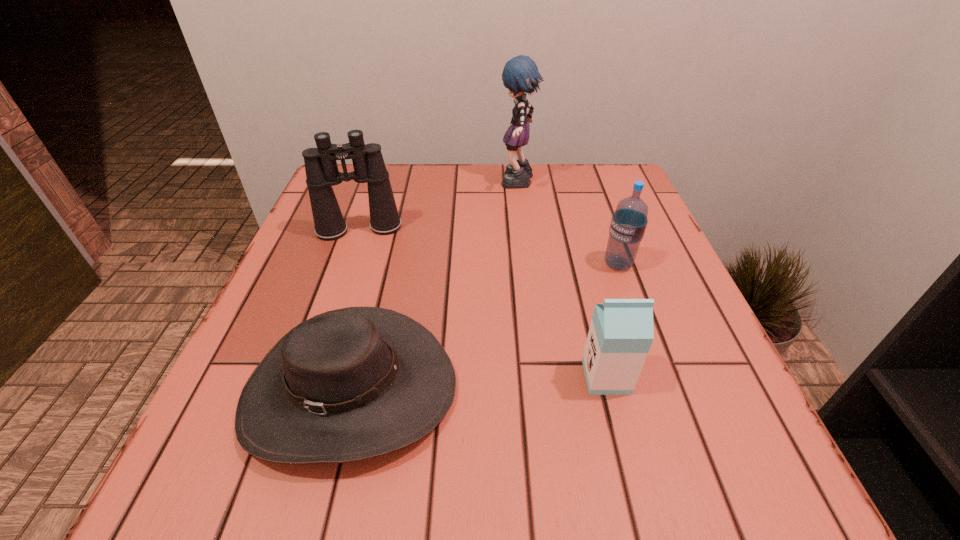
You are a GUI agent. You are given a task and a screenshot of the screen. Output one action in this format:
    pyautogui.click(x=<x>, y=<y>)
    Task: Click on the vacant space located on the front-facing side of the tallest object
    
    Given the screenshot: What is the action you would take?
    pyautogui.click(x=428, y=184)

Locate an element on the screen. This screenshot has width=960, height=540. vacant area located 0.370m on the front of the binoculars is located at coordinates (303, 390).

The width and height of the screenshot is (960, 540). What are the coordinates of `free space located on the front of the rightmost object` in the screenshot? It's located at (666, 400).

In order to click on free region located on the left of the second object from right to left in this screenshot , I will do `click(412, 377)`.

In order to click on object that is at the far edge in this screenshot , I will do `click(520, 75)`.

Where is `object situated at the near edge`? object situated at the near edge is located at coordinates (350, 384).

Find the location of a particular element. This screenshot has width=960, height=540. binoculars at the left edge is located at coordinates (322, 173).

This screenshot has width=960, height=540. Identify the location of cowboy hat present at the left edge. (350, 384).

Where is `water bottle that is at the right edge`? water bottle that is at the right edge is located at coordinates (629, 221).

Locate an element on the screen. milk carton that is at the right edge is located at coordinates (621, 332).